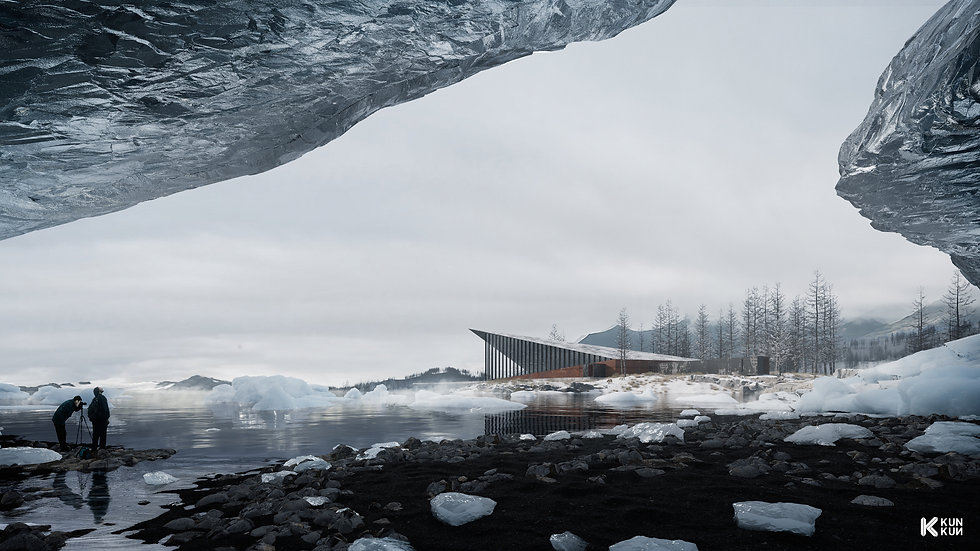
You are a GUI agent. You are given a task and a screenshot of the screen. Output one action in this format:
    pyautogui.click(x=<x>, y=<y>)
    Task: Click on the tripod the camera is on
    
    Given the screenshot: What is the action you would take?
    tap(78, 417)